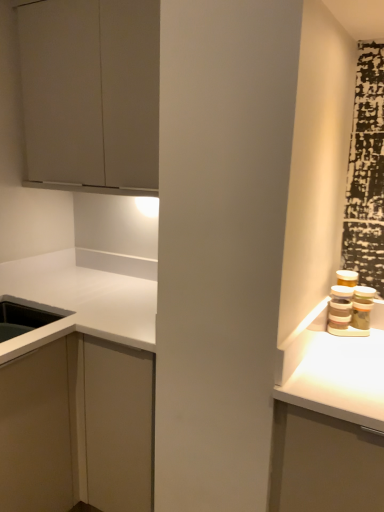
Question: Is matte gray cabinet at upper left, the second cabinetry ordered from the bottom, to the left or to the right of white matte cabinet at lower left, arranged as the 2th cabinetry when viewed from the top, in the image?

Choices:
 (A) right
 (B) left

Answer: (A)

Question: Considering the positions of matte gray cabinet at upper left, marked as the first cabinetry in a top-to-bottom arrangement, and white matte cabinet at lower left, the 1th cabinetry positioned from the bottom, in the image, is matte gray cabinet at upper left, marked as the first cabinetry in a top-to-bottom arrangement, bigger or smaller than white matte cabinet at lower left, the 1th cabinetry positioned from the bottom,?

Choices:
 (A) big
 (B) small

Answer: (B)

Question: Does point [x=34, y=29] appear closer or farther from the camera than point [x=132, y=329]?

Choices:
 (A) closer
 (B) farther

Answer: (B)

Question: Considering the relative positions of white matte cabinet at lower left, arranged as the 2th cabinetry when viewed from the top, and matte gray cabinet at upper left, the second cabinetry ordered from the bottom, in the image provided, is white matte cabinet at lower left, arranged as the 2th cabinetry when viewed from the top, to the left or to the right of matte gray cabinet at upper left, the second cabinetry ordered from the bottom,?

Choices:
 (A) right
 (B) left

Answer: (B)

Question: Is point (3, 492) closer or farther from the camera than point (127, 67)?

Choices:
 (A) closer
 (B) farther

Answer: (A)

Question: From the image's perspective, is white matte cabinet at lower left, arranged as the 2th cabinetry when viewed from the top, positioned above or below matte gray cabinet at upper left, marked as the first cabinetry in a top-to-bottom arrangement?

Choices:
 (A) below
 (B) above

Answer: (A)

Question: Is white matte cabinet at lower left, arranged as the 2th cabinetry when viewed from the top, wider or thinner than matte gray cabinet at upper left, marked as the first cabinetry in a top-to-bottom arrangement?

Choices:
 (A) thin
 (B) wide

Answer: (B)